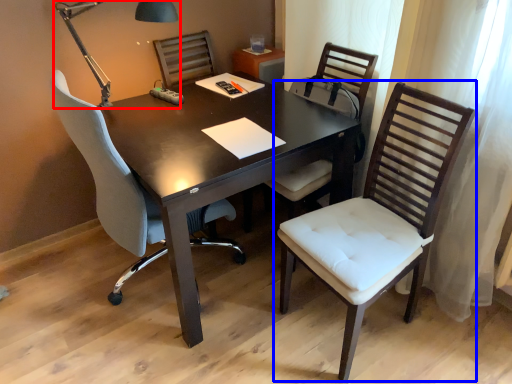
Question: Which of the following is the farthest to the observer, table lamp (highlighted by a red box) or chair (highlighted by a blue box)?

Choices:
 (A) table lamp
 (B) chair

Answer: (A)